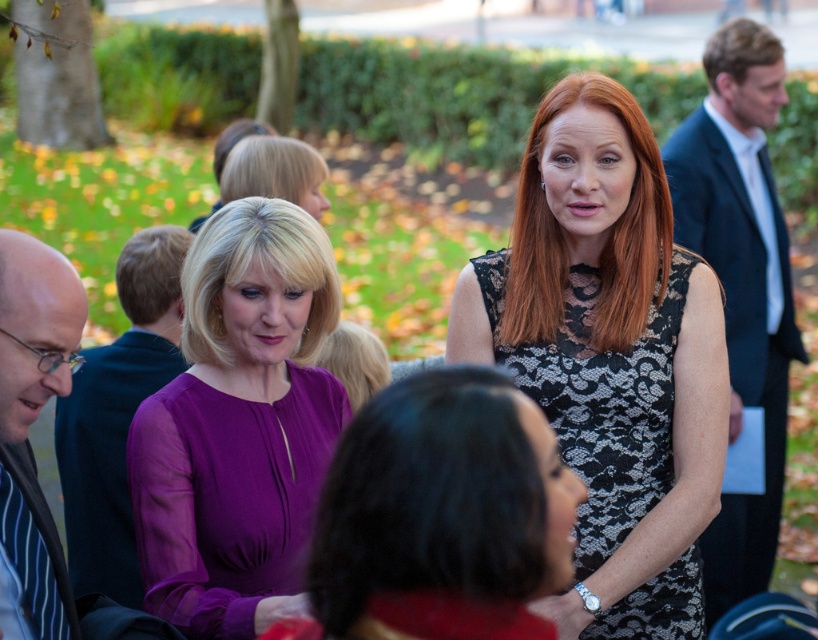
Question: Can you confirm if dark blue suit at right is positioned below matte black suit at left?

Choices:
 (A) no
 (B) yes

Answer: (A)

Question: Which point is closer to the camera?

Choices:
 (A) purple lace dress at center
 (B) striped fabric shirt at left
 (C) matte black suit at left
 (D) purple satin blouse at center

Answer: (A)

Question: Is purple lace dress at center closer to camera compared to striped fabric shirt at left?

Choices:
 (A) no
 (B) yes

Answer: (B)

Question: Does black lace dress at center have a larger size compared to striped fabric shirt at left?

Choices:
 (A) no
 (B) yes

Answer: (B)

Question: Which point appears farthest from the camera in this image?

Choices:
 (A) (23, 438)
 (B) (749, 156)

Answer: (B)

Question: Which of the following is the farthest from the observer?

Choices:
 (A) striped fabric shirt at left
 (B) dark blue suit at right

Answer: (B)